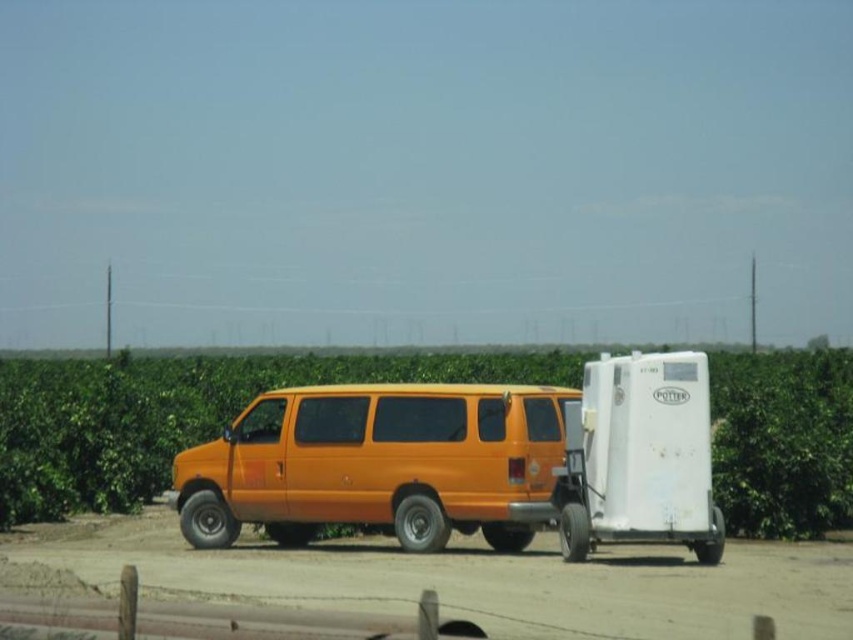
You are a drone operator trying to capture a photo of the green leafy corn field at center from above. The drone must stay within the boundaries of the field to avoid damaging crops. Given the field is at point coordinates, can you confirm if the drone can safely hover over the field without going outside its boundaries?

The green leafy corn field at center is located at coordinates point (177, 413). Since the drone must stay within the field boundaries, it can safely hover over the field as long as it stays within the field area defined by those coordinates.

You are a photographer trying to capture the entire orange matte van at center in your shot. Considering the green leafy corn field at center is wider than the van, how might the composition look in terms of the van and field?

The green leafy corn field at center is wider than the orange matte van at center, so the van will appear narrower compared to the field in the composition.

You are a delivery driver who needs to park your orange matte van at center in a spot that is at least 15 meters away from the green leafy corn field at center. Based on the image, is the current parking position of your van compliant with this requirement?

The distance between the green leafy corn field at center and the orange matte van at center is 15.11 meters, which meets the minimum requirement of 15 meters. Therefore, the current parking position is compliant.